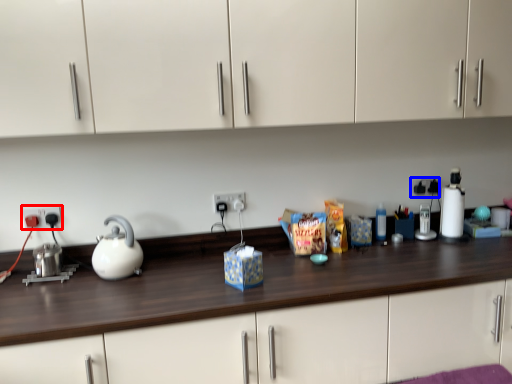
Question: Which of the following is the farthest to the observer, electric outlet (highlighted by a red box) or electric outlet (highlighted by a blue box)?

Choices:
 (A) electric outlet
 (B) electric outlet

Answer: (B)